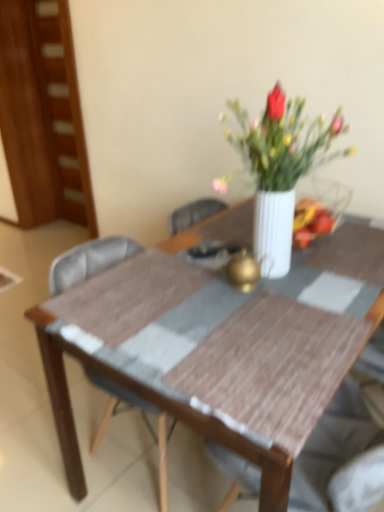
Question: Should I look upward or downward to see wooden table at center?

Choices:
 (A) down
 (B) up

Answer: (A)